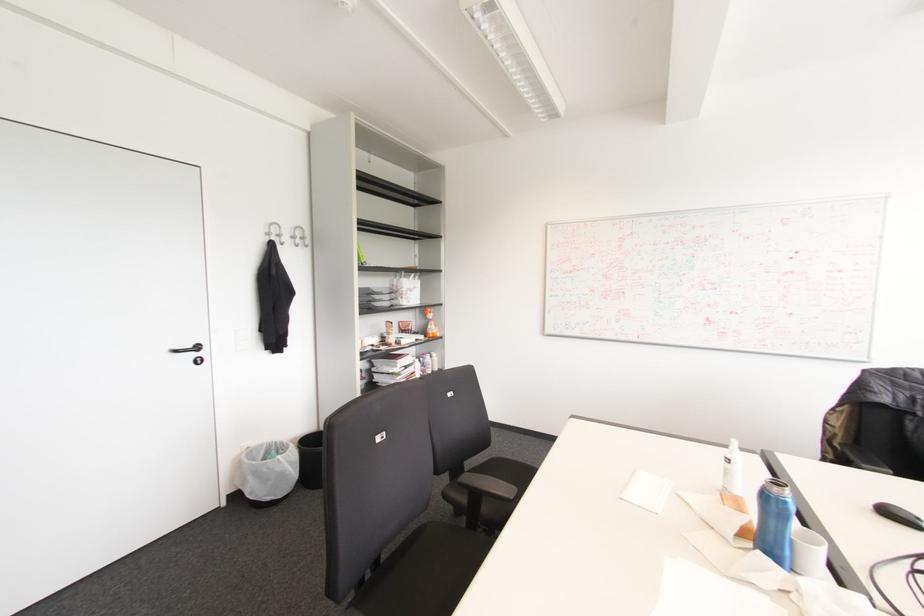
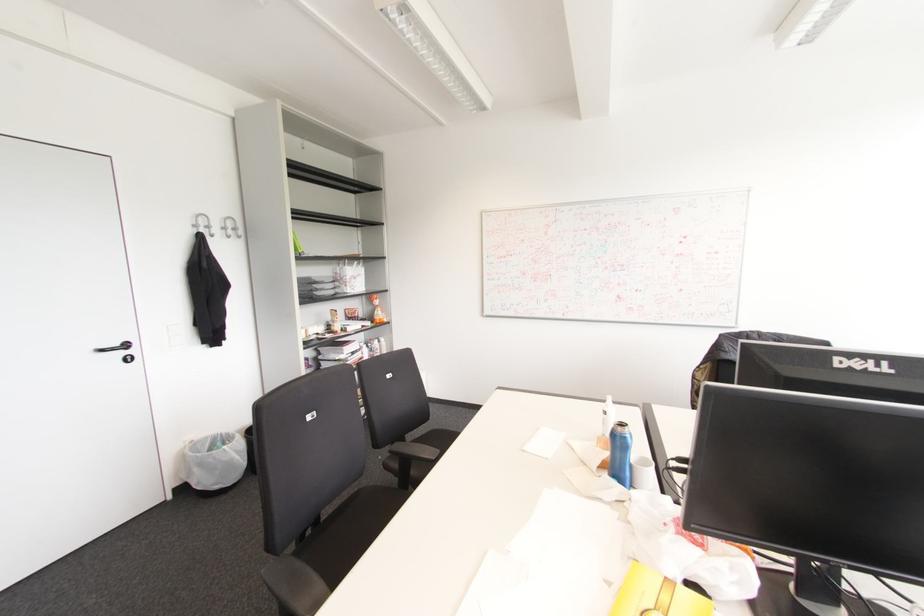
Find the pixel in the second image that matches (301,238) in the first image.

(234, 229)